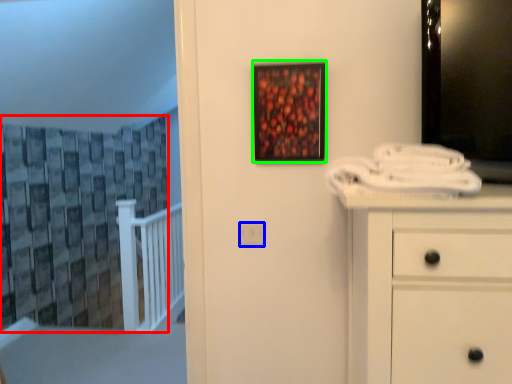
Question: Which object is positioned farthest from curtain (highlighted by a red box)? Select from electric outlet (highlighted by a blue box) and picture frame (highlighted by a green box).

Choices:
 (A) electric outlet
 (B) picture frame

Answer: (A)